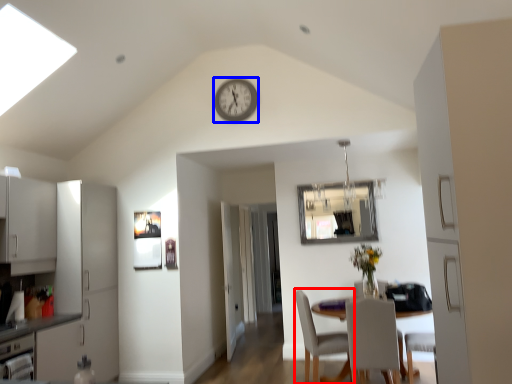
Question: Among these objects, which one is farthest to the camera, chair (highlighted by a red box) or clock (highlighted by a blue box)?

Choices:
 (A) chair
 (B) clock

Answer: (B)